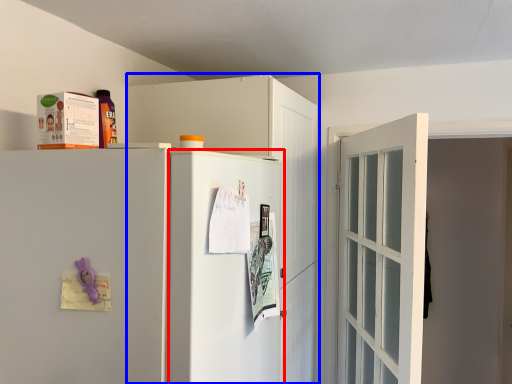
Question: Which object appears closest to the camera in this image, screen door (highlighted by a red box) or cabinetry (highlighted by a blue box)?

Choices:
 (A) screen door
 (B) cabinetry

Answer: (A)